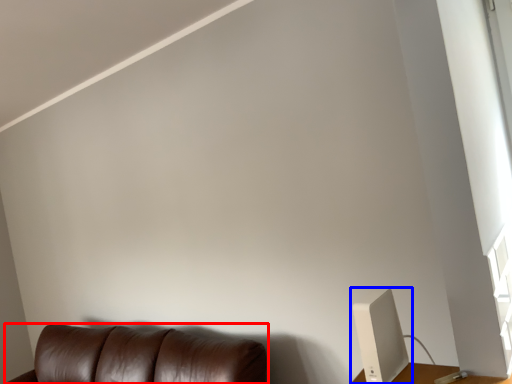
Question: Among these objects, which one is nearest to the camera, furniture (highlighted by a red box) or computer monitor (highlighted by a blue box)?

Choices:
 (A) furniture
 (B) computer monitor

Answer: (B)